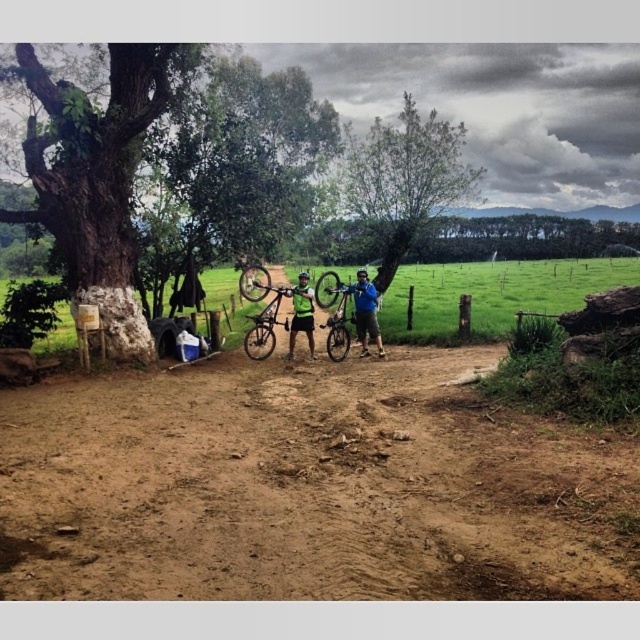
Question: Is brown sandy dirt at center to the right of green matte mountain bike at center from the viewer's perspective?

Choices:
 (A) no
 (B) yes

Answer: (B)

Question: Is brown sandy dirt at center above green matte mountain bike at center?

Choices:
 (A) no
 (B) yes

Answer: (A)

Question: Among these points, which one is nearest to the camera?

Choices:
 (A) (416, 141)
 (B) (272, 285)
 (C) (273, 518)

Answer: (C)

Question: Estimate the real-world distances between objects in this image. Which object is closer to the green rough bark tree at left?

Choices:
 (A) green matte mountain bike at center
 (B) shiny silver mountain bike at center
 (C) green leafy tree at upper center

Answer: (B)

Question: Among these points, which one is nearest to the camera?

Choices:
 (A) (589, 442)
 (B) (246, 337)
 (C) (416, 198)
 (D) (289, 337)

Answer: (A)

Question: Can you confirm if green rough bark tree at left is smaller than shiny silver mountain bike at center?

Choices:
 (A) yes
 (B) no

Answer: (B)